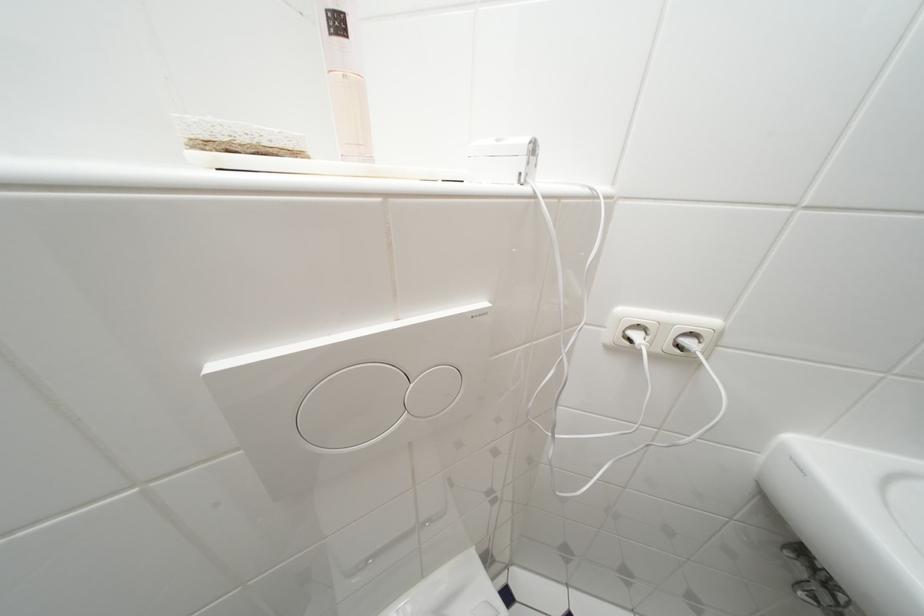
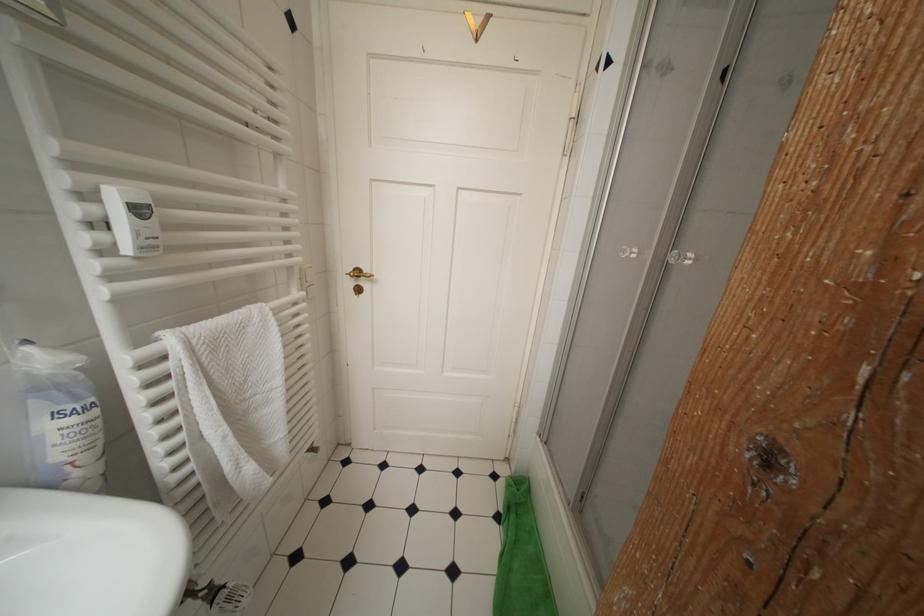
First-person continuous shooting, in which direction is the camera rotating?

The camera's rotation is toward right-down.